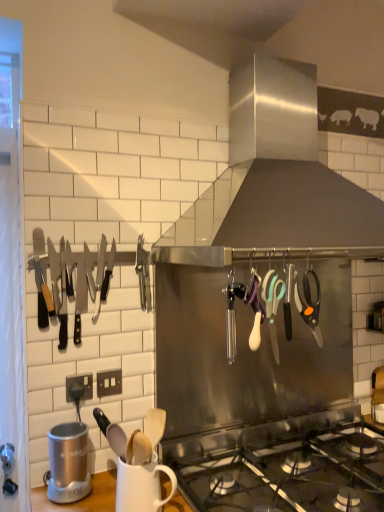
Question: From the image's perspective, is stainless steel knives at left located above or below stainless steel range hood at upper center?

Choices:
 (A) below
 (B) above

Answer: (A)

Question: Is point (74, 324) closer or farther from the camera than point (309, 176)?

Choices:
 (A) closer
 (B) farther

Answer: (A)

Question: Based on their relative distances, which object is farther from the stainless steel knives at left?

Choices:
 (A) teal plastic scissors at center, which is the second scissors in right-to-left order
 (B) silver metallic blender at lower left
 (C) white matte mug at lower center
 (D) stainless steel range hood at upper center
 (E) orange-handled scissors at center-right, the 2th scissors viewed from the left

Answer: (D)

Question: Which object is the farthest from the stainless steel knives at left?

Choices:
 (A) stainless steel range hood at upper center
 (B) orange-handled scissors at center-right, positioned as the first scissors in right-to-left order
 (C) silver metallic blender at lower left
 (D) teal plastic scissors at center, which is the second scissors in right-to-left order
 (E) white matte mug at lower center

Answer: (A)